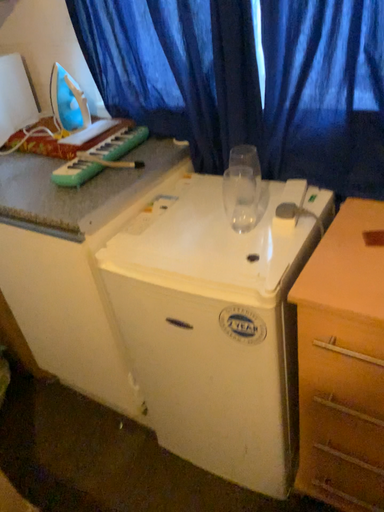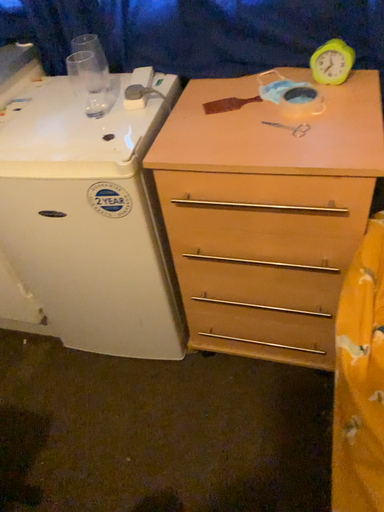
Question: Which way did the camera rotate in the video?

Choices:
 (A) rotated left
 (B) rotated right

Answer: (B)